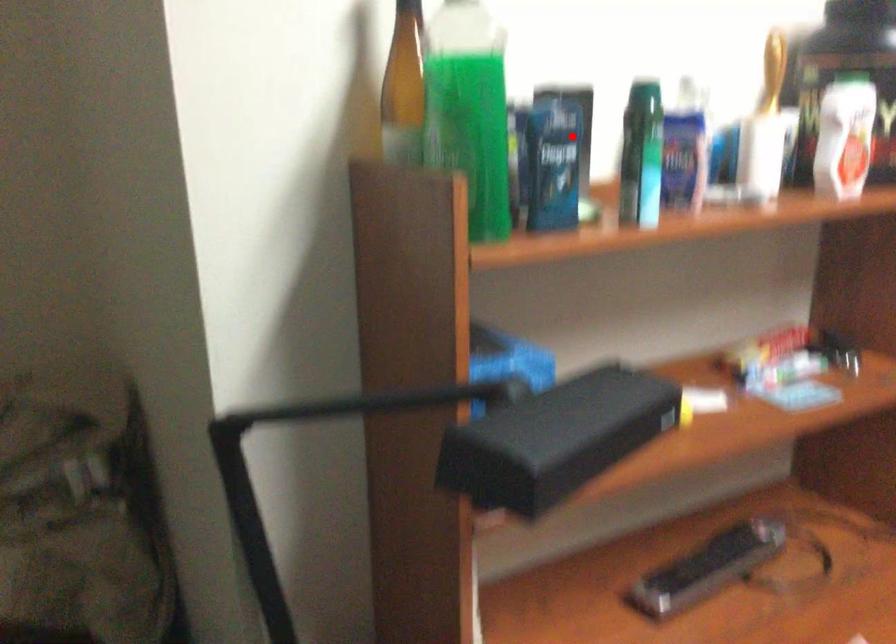
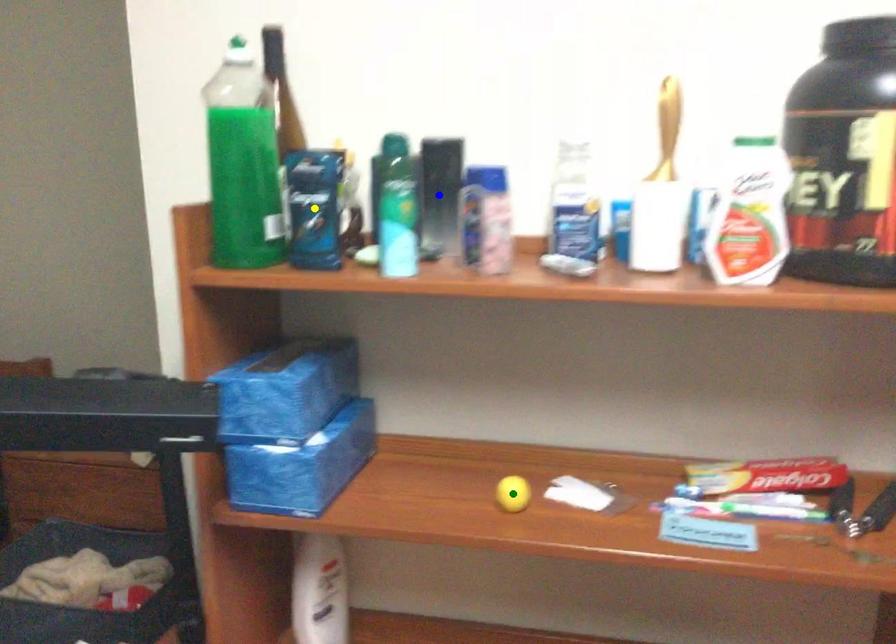
Question: I am providing you with two images of the same scene from different viewpoints. A red point is marked on the first image. You are given multiple points on the second image. Which point in image 2 is actually the same real-world point as the red point in image 1?

Choices:
 (A) yellow point
 (B) blue point
 (C) green point

Answer: (B)